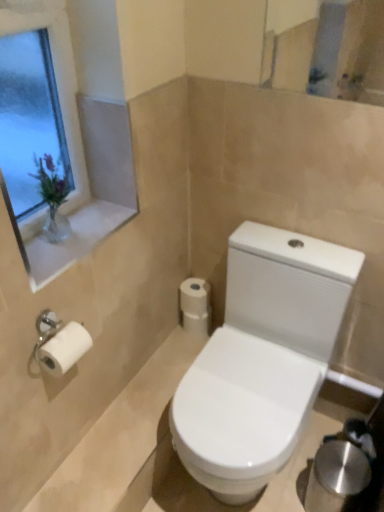
Question: From a real-world perspective, is white glossy window sill at upper left above or below white glossy toilet at lower center?

Choices:
 (A) above
 (B) below

Answer: (A)

Question: Considering their positions, is white glossy window sill at upper left located in front of or behind white glossy toilet at lower center?

Choices:
 (A) behind
 (B) front

Answer: (B)

Question: Considering the real-world distances, which object is closest to the white glossy window sill at upper left?

Choices:
 (A) clear glass vase at upper left
 (B) white matte toilet paper at center
 (C) white glossy toilet at lower center

Answer: (A)

Question: Which object is the closest to the white matte toilet paper at center?

Choices:
 (A) clear glass vase at upper left
 (B) white glossy window sill at upper left
 (C) white glossy toilet at lower center

Answer: (C)